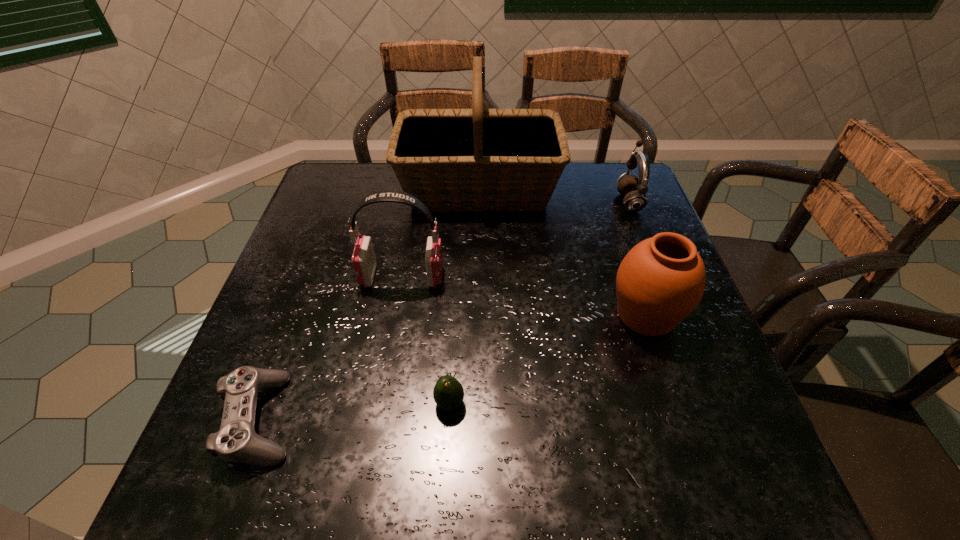
Identify the location of vacant position located on the outer surface of the left earphone. Image resolution: width=960 pixels, height=540 pixels. (489, 277).

At what (x,y) coordinates should I click in order to perform the action: click on vacant position located 0.310m on the left of the fourth shortest object. Please return your answer as a coordinate pair (x, y). This screenshot has width=960, height=540. Looking at the image, I should click on (466, 315).

Find the location of a particular element. free space located on the ear pads of the right earphone is located at coordinates (578, 201).

Locate an element on the screen. This screenshot has height=540, width=960. free space located 0.070m on the ear pads of the right earphone is located at coordinates (592, 201).

Locate an element on the screen. The height and width of the screenshot is (540, 960). free space located 0.320m on the ear pads of the right earphone is located at coordinates (504, 201).

The width and height of the screenshot is (960, 540). I want to click on vacant space located 0.240m on the right of the second shortest object, so click(594, 403).

Where is `free space located 0.350m on the right of the shortest object`? The width and height of the screenshot is (960, 540). free space located 0.350m on the right of the shortest object is located at coordinates 493,418.

Where is `basket positioned at the far edge`? This screenshot has width=960, height=540. basket positioned at the far edge is located at coordinates (477, 159).

The width and height of the screenshot is (960, 540). What are the coordinates of `earphone that is at the far edge` in the screenshot? It's located at (634, 189).

Image resolution: width=960 pixels, height=540 pixels. Find the location of `object at the near edge`. object at the near edge is located at coordinates (237, 441).